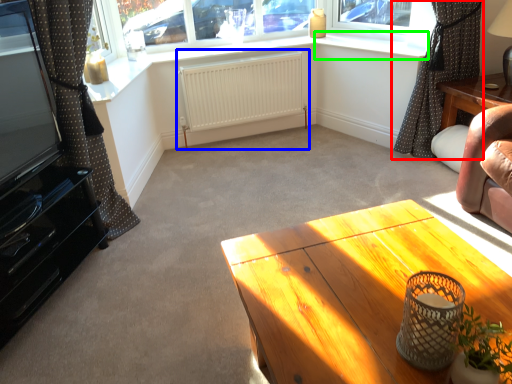
Question: Which object is the farthest from curtain (highlighted by a red box)? Choose among these: radiator (highlighted by a blue box) or window sill (highlighted by a green box).

Choices:
 (A) radiator
 (B) window sill

Answer: (A)